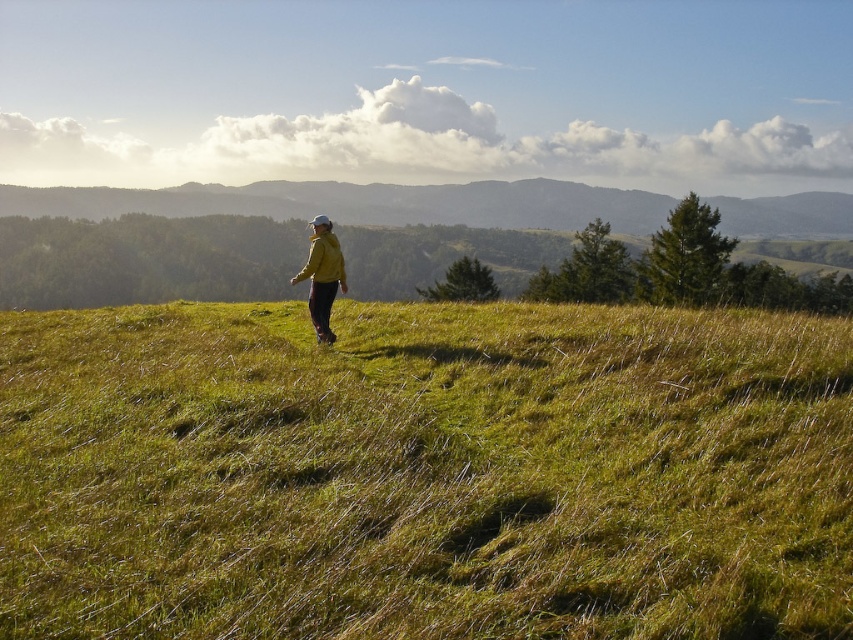
You are a photographer trying to capture the entire scene of the green grassy hillside at center and the matte yellow jacket at center in a single photo. Based on their sizes, which object will occupy more of the frame?

The green grassy hillside at center is larger in size than the matte yellow jacket at center, so it will occupy more of the frame.

You are a photographer trying to capture the yellow matte jacket at center and the matte yellow jacket at center in the same frame. Since they are the same color, how can you distinguish them in your photo?

The yellow matte jacket at center is 7.14 inches from matte yellow jacket at center, so you can distinguish them by their distance apart in the photo.